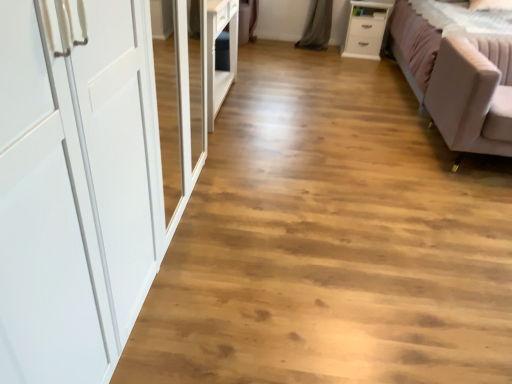
Question: Based on their positions, is white glossy chest of drawers at upper right located to the left or right of light pink fabric studio couch at right?

Choices:
 (A) right
 (B) left

Answer: (B)

Question: From the image's perspective, is white glossy chest of drawers at upper right above or below light pink fabric studio couch at right?

Choices:
 (A) below
 (B) above

Answer: (B)

Question: Which is nearer to the light pink fabric studio couch at right?

Choices:
 (A) white glossy chest of drawers at upper right
 (B) matte white wardrobe at left

Answer: (B)

Question: Estimate the real-world distances between objects in this image. Which object is closer to the light pink fabric studio couch at right?

Choices:
 (A) matte white wardrobe at left
 (B) white glossy chest of drawers at upper right

Answer: (A)